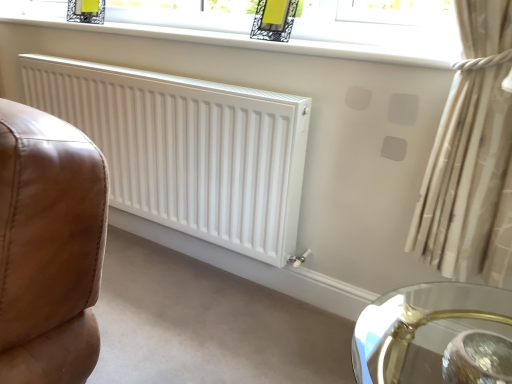
Question: Is white matte radiator at center taller or shorter than beige fabric curtain at right?

Choices:
 (A) short
 (B) tall

Answer: (B)

Question: Would you say white matte radiator at center is inside or outside beige fabric curtain at right?

Choices:
 (A) outside
 (B) inside

Answer: (A)

Question: Estimate the real-world distances between objects in this image. Which object is farther from the clear glass window at upper center?

Choices:
 (A) white matte radiator at center
 (B) beige fabric curtain at right

Answer: (B)

Question: Estimate the real-world distances between objects in this image. Which object is farther from the white matte radiator at center?

Choices:
 (A) beige fabric curtain at right
 (B) clear glass window at upper center

Answer: (A)